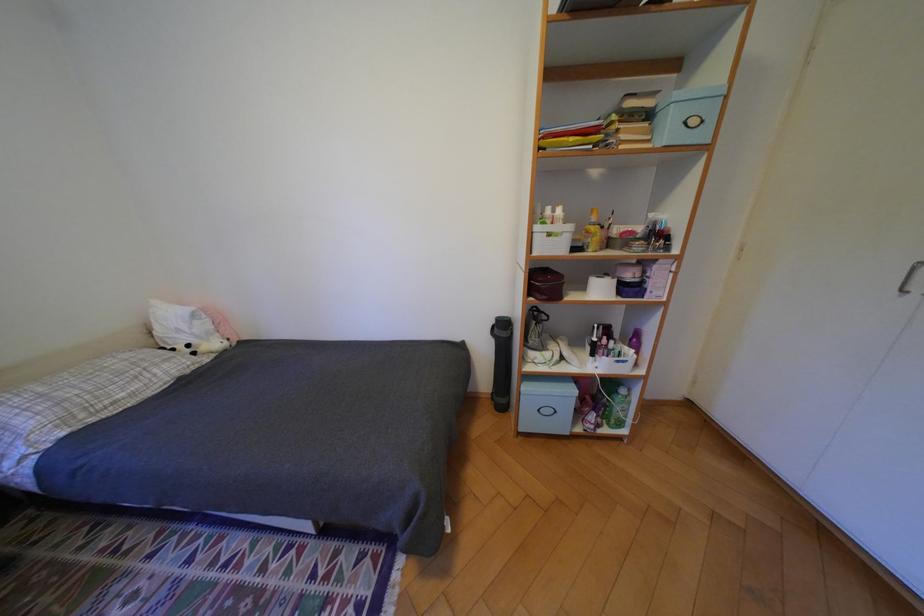
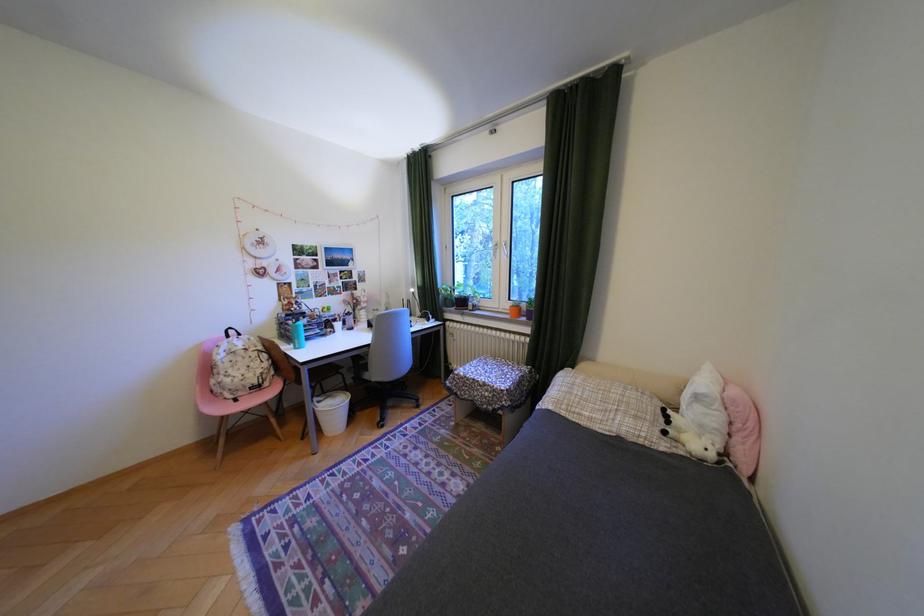
In the second image, find the point that corresponds to the point at 205,353 in the first image.

(676, 432)